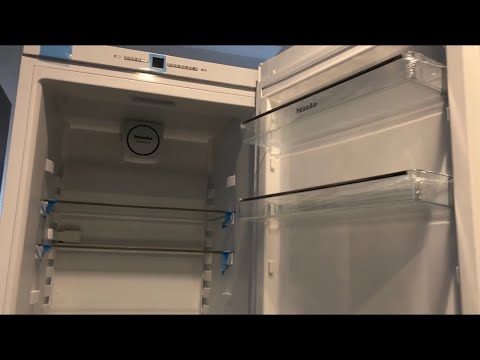
This screenshot has width=480, height=360. I want to click on refrigerator base, so click(22, 129).